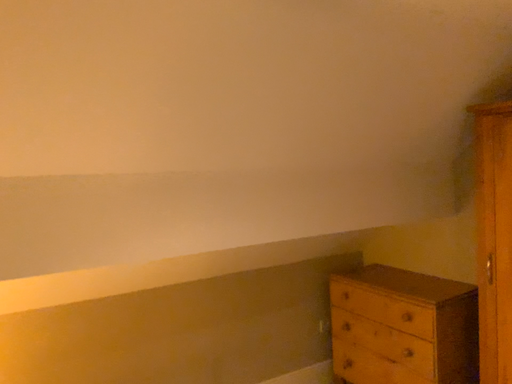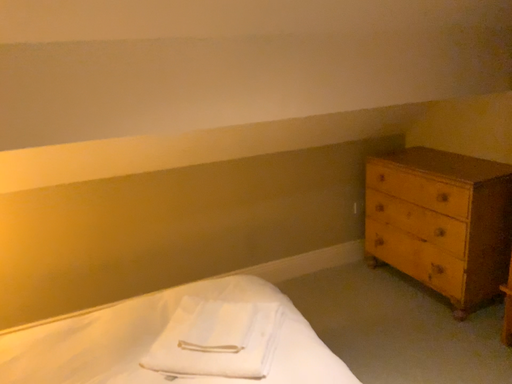
Question: How did the camera likely rotate when shooting the video?

Choices:
 (A) rotated left
 (B) rotated right

Answer: (A)